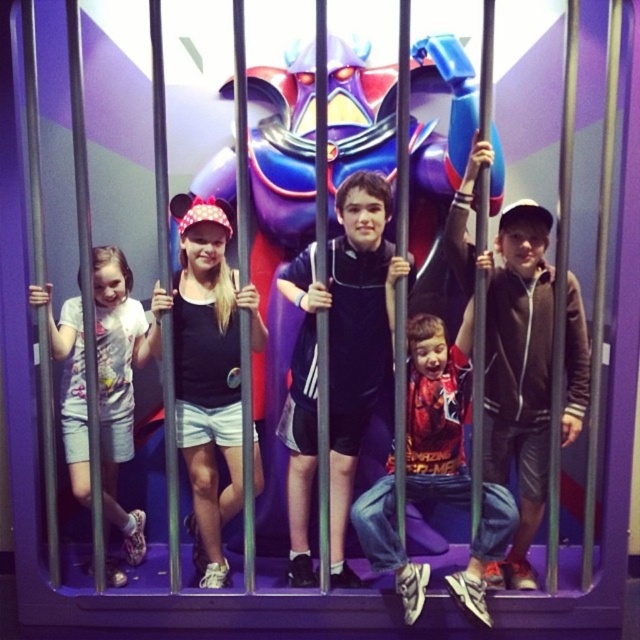
You are a photographer trying to capture a clear shot of the glossy plastic robot at center and the brown fleece jacket at center. Since the robot is larger, where should you position your camera to ensure both are in focus?

The glossy plastic robot at center is bigger than the brown fleece jacket at center, so you should position your camera closer to the brown fleece jacket at center to balance their sizes in the frame.

You are a photographer trying to capture a group photo of the children. You notice the brown fleece jacket at center and the white cotton shirt at left. Which child should you ask to move closer to avoid being cut off in the photo?

The brown fleece jacket at center has a larger width than the white cotton shirt at left, so you should ask the child wearing the brown fleece jacket at center to move closer to avoid being cut off in the photo.